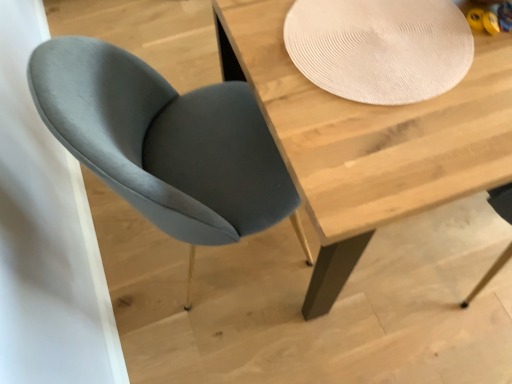
Question: Is wooden table at center inside the boundaries of beige textured placemat at upper center, or outside?

Choices:
 (A) inside
 (B) outside

Answer: (B)

Question: Considering the relative positions of wooden table at center and beige textured placemat at upper center in the image provided, is wooden table at center to the left or to the right of beige textured placemat at upper center?

Choices:
 (A) left
 (B) right

Answer: (B)

Question: Estimate the real-world distances between objects in this image. Which object is farther from the velvet grey chair at left?

Choices:
 (A) beige textured placemat at upper center
 (B) wooden table at center

Answer: (A)

Question: Which object is the farthest from the beige textured placemat at upper center?

Choices:
 (A) wooden table at center
 (B) velvet grey chair at left

Answer: (B)